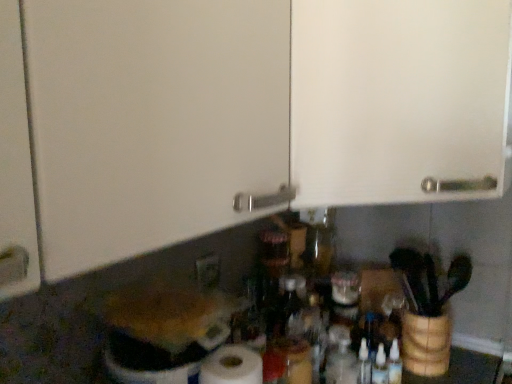
Question: Is white matte cabinet door at upper center at the back of transparent plastic bottle at center?

Choices:
 (A) no
 (B) yes

Answer: (A)

Question: From a real-world perspective, is transparent plastic bottle at center under white matte cabinet door at upper center?

Choices:
 (A) yes
 (B) no

Answer: (A)

Question: Is white matte cabinet door at upper center completely or partially inside transparent plastic bottle at center?

Choices:
 (A) no
 (B) yes

Answer: (A)

Question: Does transparent plastic bottle at center have a greater width compared to white matte cabinet door at upper center?

Choices:
 (A) yes
 (B) no

Answer: (B)

Question: Considering the relative sizes of transparent plastic bottle at center and white matte cabinet door at upper center in the image provided, is transparent plastic bottle at center bigger than white matte cabinet door at upper center?

Choices:
 (A) yes
 (B) no

Answer: (B)

Question: Does transparent plastic bottle at center lie behind white matte cabinet door at upper center?

Choices:
 (A) no
 (B) yes

Answer: (B)

Question: Is white matte cabinet door at upper center at the left side of matte white electric outlet at lower center?

Choices:
 (A) yes
 (B) no

Answer: (B)

Question: Is white matte cabinet door at upper center thinner than matte white electric outlet at lower center?

Choices:
 (A) yes
 (B) no

Answer: (B)

Question: Could you tell me if white matte cabinet door at upper center is facing matte white electric outlet at lower center?

Choices:
 (A) no
 (B) yes

Answer: (A)

Question: Can we say white matte cabinet door at upper center lies outside matte white electric outlet at lower center?

Choices:
 (A) no
 (B) yes

Answer: (B)

Question: Does white matte cabinet door at upper center come behind matte white electric outlet at lower center?

Choices:
 (A) yes
 (B) no

Answer: (B)

Question: Is white matte cabinet door at upper center wider than matte white electric outlet at lower center?

Choices:
 (A) yes
 (B) no

Answer: (A)

Question: Can white matte cabinet door at upper center be found inside matte white electric outlet at lower center?

Choices:
 (A) yes
 (B) no

Answer: (B)